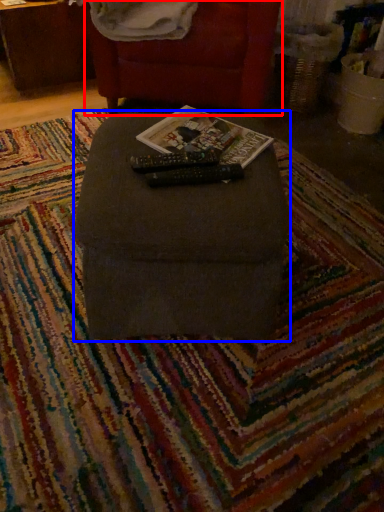
Question: Which of the following is the closest to the observer, furniture (highlighted by a red box) or furniture (highlighted by a blue box)?

Choices:
 (A) furniture
 (B) furniture

Answer: (B)